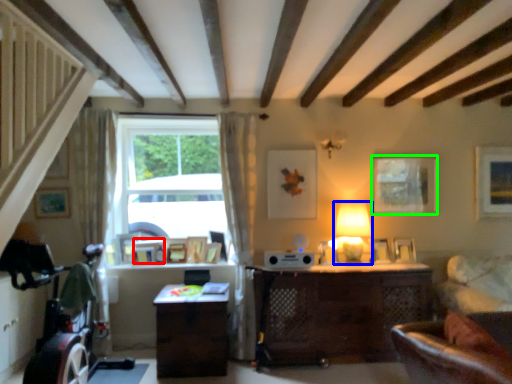
Question: Which object is the closest to the picture frame (highlighted by a red box)? Choose among these: table lamp (highlighted by a blue box) or picture frame (highlighted by a green box).

Choices:
 (A) table lamp
 (B) picture frame

Answer: (A)